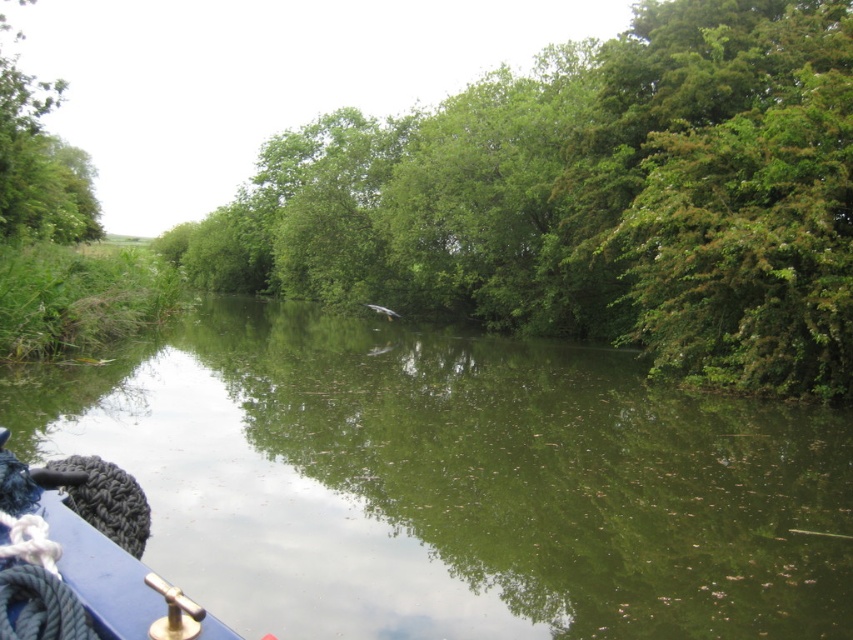
You are on a boat and want to know if you can reach a green leafy tree at center with a 10 meter long fishing rod. Can you do it?

The distance between you and the green leafy tree at center is 15.43 meters, which is longer than the 10 meter fishing rod. Therefore, you cannot reach it.

You are on a boat in the canal and want to know which of the two points, point [135,624] or point [65,195], is closer to you. Can you determine this based on the scene?

Point [135,624] is closer to the viewer than point [65,195], so the point closer to you is point [135,624].